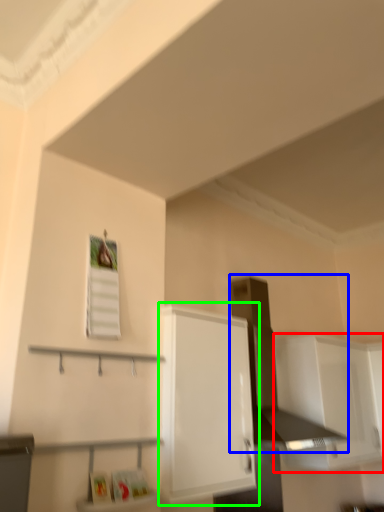
Question: Considering the real-world distances, which object is farthest from cabinetry (highlighted by a red box)? vent (highlighted by a blue box) or cabinetry (highlighted by a green box)?

Choices:
 (A) vent
 (B) cabinetry

Answer: (B)